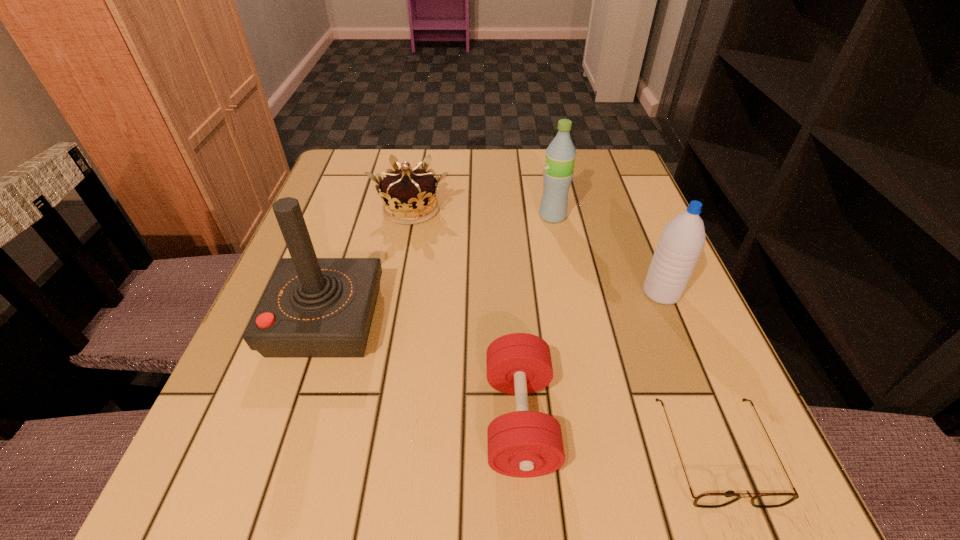
Where is `vacant area situated 0.270m on the back of the right water bottle`? vacant area situated 0.270m on the back of the right water bottle is located at coordinates (623, 200).

Where is `vacant space located 0.160m on the back of the crown`? This screenshot has width=960, height=540. vacant space located 0.160m on the back of the crown is located at coordinates (421, 157).

I want to click on free point located 0.260m on the left of the dumbbell, so click(308, 420).

The width and height of the screenshot is (960, 540). What are the coordinates of `object that is at the far edge` in the screenshot? It's located at (409, 196).

This screenshot has width=960, height=540. What are the coordinates of `dumbbell that is positioned at the near edge` in the screenshot? It's located at (523, 444).

Where is `sunglasses present at the near edge`? Image resolution: width=960 pixels, height=540 pixels. sunglasses present at the near edge is located at coordinates (707, 500).

Identify the location of joystick that is at the left edge. The image size is (960, 540). (313, 307).

The image size is (960, 540). Identify the location of crown located in the left edge section of the desktop. (x=409, y=196).

Where is `water bottle that is positioned at the right edge`? water bottle that is positioned at the right edge is located at coordinates (681, 242).

Where is `sunglasses positioned at the right edge`? The width and height of the screenshot is (960, 540). sunglasses positioned at the right edge is located at coordinates (707, 500).